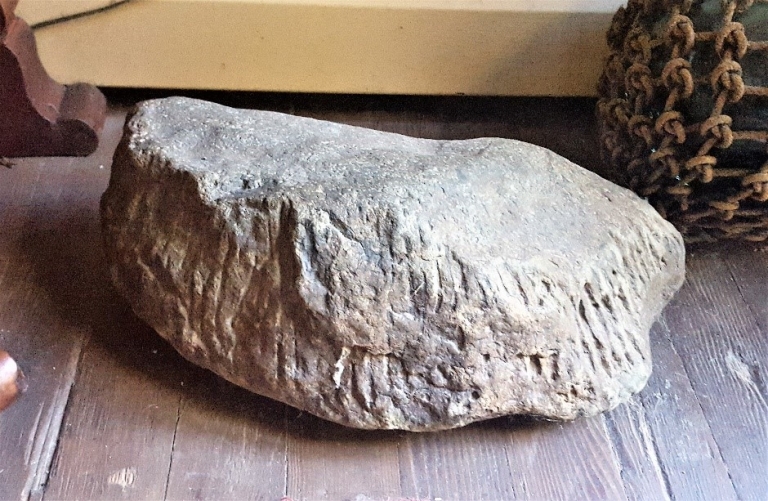
Locate an element on the screen. The width and height of the screenshot is (768, 501). cord is located at coordinates (68, 19).